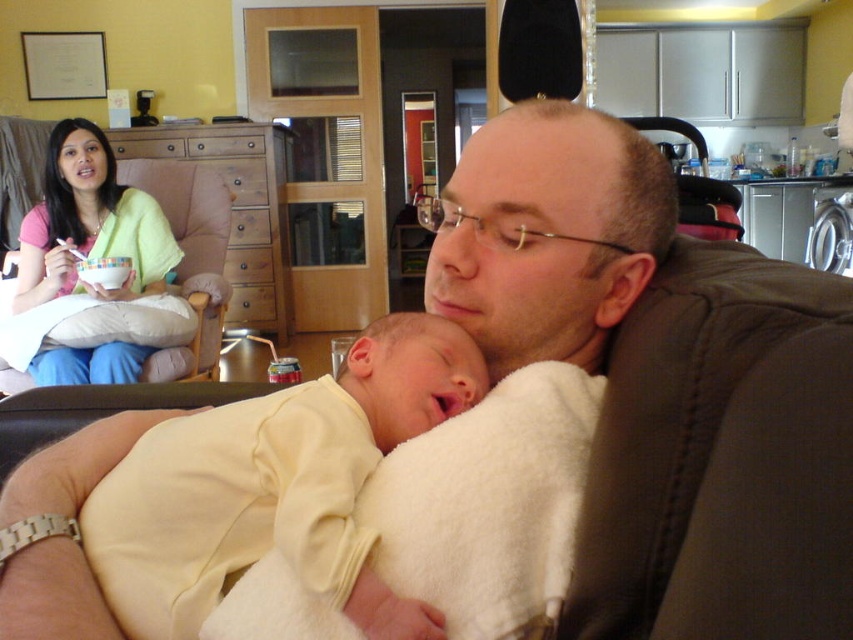
Question: Does smooth beige blanket at center have a lesser width compared to pink fabric shirt at upper left?

Choices:
 (A) no
 (B) yes

Answer: (B)

Question: Which object appears farthest from the camera in this image?

Choices:
 (A) smooth beige blanket at center
 (B) pink fabric shirt at upper left
 (C) soft yellow onesie at center

Answer: (B)

Question: Can you confirm if smooth beige blanket at center is smaller than pink fabric shirt at upper left?

Choices:
 (A) no
 (B) yes

Answer: (B)

Question: Can you confirm if smooth beige blanket at center is bigger than pink fabric shirt at upper left?

Choices:
 (A) no
 (B) yes

Answer: (A)

Question: Estimate the real-world distances between objects in this image. Which object is closer to the smooth beige blanket at center?

Choices:
 (A) pink fabric shirt at upper left
 (B) soft yellow onesie at center

Answer: (B)

Question: Which of these objects is positioned farthest from the pink fabric shirt at upper left?

Choices:
 (A) soft yellow onesie at center
 (B) smooth beige blanket at center

Answer: (B)